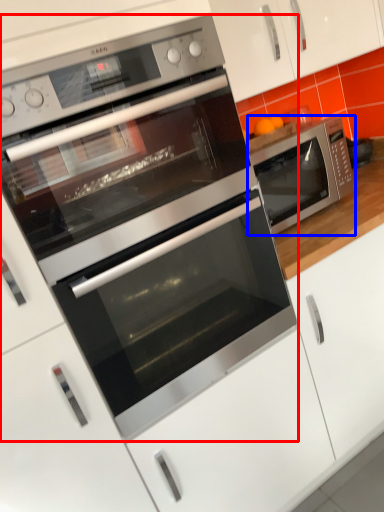
Question: Which object is closer to the camera taking this photo, microwave oven (highlighted by a red box) or microwave oven (highlighted by a blue box)?

Choices:
 (A) microwave oven
 (B) microwave oven

Answer: (A)